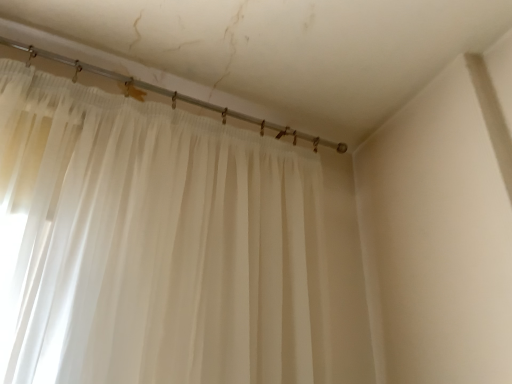
What do you see at coordinates (174, 96) in the screenshot? The height and width of the screenshot is (384, 512). I see `translucent plastic curtain rod at upper center` at bounding box center [174, 96].

At what (x,y) coordinates should I click in order to perform the action: click on translucent plastic curtain rod at upper center. Please return your answer as a coordinate pair (x, y). Looking at the image, I should click on (174, 96).

This screenshot has height=384, width=512. I want to click on sheer white curtain at upper left, so click(167, 247).

The height and width of the screenshot is (384, 512). What do you see at coordinates (167, 247) in the screenshot? I see `sheer white curtain at upper left` at bounding box center [167, 247].

This screenshot has width=512, height=384. I want to click on translucent plastic curtain rod at upper center, so click(174, 96).

Between translucent plastic curtain rod at upper center and sheer white curtain at upper left, which one appears on the right side from the viewer's perspective?

sheer white curtain at upper left is more to the right.

Which is in front, translucent plastic curtain rod at upper center or sheer white curtain at upper left?

sheer white curtain at upper left is closer to the camera.

Does point (170, 96) appear closer or farther from the camera than point (111, 153)?

Point (170, 96) is positioned farther from the camera compared to point (111, 153).

From the image's perspective, is translucent plastic curtain rod at upper center positioned above or below sheer white curtain at upper left?

translucent plastic curtain rod at upper center is situated higher than sheer white curtain at upper left in the image.

From a real-world perspective, which object rests below the other?

sheer white curtain at upper left is physically lower.

Does translucent plastic curtain rod at upper center have a greater width compared to sheer white curtain at upper left?

No, translucent plastic curtain rod at upper center is not wider than sheer white curtain at upper left.

Can you confirm if translucent plastic curtain rod at upper center is taller than sheer white curtain at upper left?

No, translucent plastic curtain rod at upper center is not taller than sheer white curtain at upper left.

Who is bigger, translucent plastic curtain rod at upper center or sheer white curtain at upper left?

sheer white curtain at upper left.

Is translucent plastic curtain rod at upper center surrounding sheer white curtain at upper left?

That's incorrect, sheer white curtain at upper left is not inside translucent plastic curtain rod at upper center.

Is there a large distance between translucent plastic curtain rod at upper center and sheer white curtain at upper left?

translucent plastic curtain rod at upper center is actually quite close to sheer white curtain at upper left.

Is translucent plastic curtain rod at upper center oriented away from sheer white curtain at upper left?

That's not correct — translucent plastic curtain rod at upper center is not looking away from sheer white curtain at upper left.

Where is `beam located above the sheer white curtain at upper left (from the image's perspective)`? The height and width of the screenshot is (384, 512). beam located above the sheer white curtain at upper left (from the image's perspective) is located at coordinates (174, 96).

Which is more to the right, sheer white curtain at upper left or translucent plastic curtain rod at upper center?

sheer white curtain at upper left.

Does sheer white curtain at upper left come behind translucent plastic curtain rod at upper center?

No.

Considering the points (61, 84) and (11, 40), which point is behind, point (61, 84) or point (11, 40)?

The point (11, 40) is farther.

From the image's perspective, is sheer white curtain at upper left located above or below translucent plastic curtain rod at upper center?

From the image's perspective, sheer white curtain at upper left appears below translucent plastic curtain rod at upper center.

From a real-world perspective, who is located higher, sheer white curtain at upper left or translucent plastic curtain rod at upper center?

translucent plastic curtain rod at upper center, from a real-world perspective.

Does sheer white curtain at upper left have a greater width compared to translucent plastic curtain rod at upper center?

Correct, the width of sheer white curtain at upper left exceeds that of translucent plastic curtain rod at upper center.

Which of these two, sheer white curtain at upper left or translucent plastic curtain rod at upper center, stands taller?

sheer white curtain at upper left is taller.

Does sheer white curtain at upper left have a smaller size compared to translucent plastic curtain rod at upper center?

No, sheer white curtain at upper left is not smaller than translucent plastic curtain rod at upper center.

Would you say sheer white curtain at upper left contains translucent plastic curtain rod at upper center?

No, translucent plastic curtain rod at upper center is not surrounded by sheer white curtain at upper left.

Is sheer white curtain at upper left positioned far away from translucent plastic curtain rod at upper center?

That's not correct — sheer white curtain at upper left is a little close to translucent plastic curtain rod at upper center.

Is sheer white curtain at upper left oriented towards translucent plastic curtain rod at upper center?

No, sheer white curtain at upper left is not oriented towards translucent plastic curtain rod at upper center.

How many degrees apart are the facing directions of sheer white curtain at upper left and translucent plastic curtain rod at upper center?

They differ by 0.00817 degrees in their facing directions.

Locate an element on the screen. This screenshot has height=384, width=512. beam behind the sheer white curtain at upper left is located at coordinates (174, 96).

At what (x,y) coordinates should I click in order to perform the action: click on curtain located on the right of translucent plastic curtain rod at upper center. Please return your answer as a coordinate pair (x, y). Looking at the image, I should click on (167, 247).

Locate an element on the screen. This screenshot has height=384, width=512. beam behind the sheer white curtain at upper left is located at coordinates [x=174, y=96].